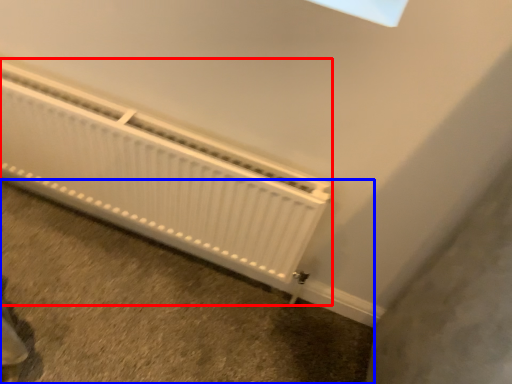
Question: Which object is closer to the camera taking this photo, radiator (highlighted by a red box) or concrete (highlighted by a blue box)?

Choices:
 (A) radiator
 (B) concrete

Answer: (A)